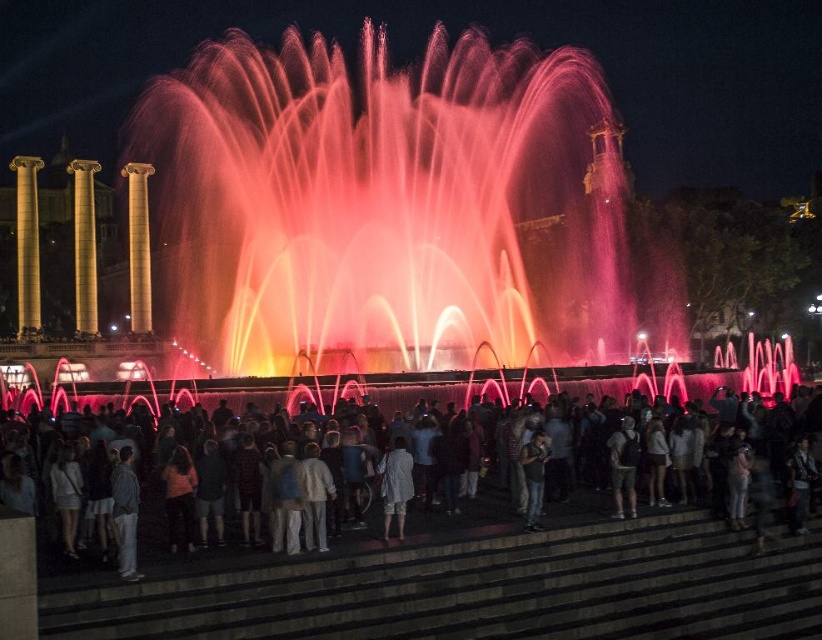
You are standing at the base of the staircase leading up to the fountain and see the yellow polished stone column at left and the gold polished column at center. Which column is located to the left of the other?

The yellow polished stone column at left is positioned on the left side of the gold polished column at center.

You are standing at the bottom of the dark gray concrete stairs at lower center, looking up towards the shimmering pink water at center. Which object is closer to you?

The dark gray concrete stairs at lower center are closer to you since they are at your current position, while the shimmering pink water at center is further away.